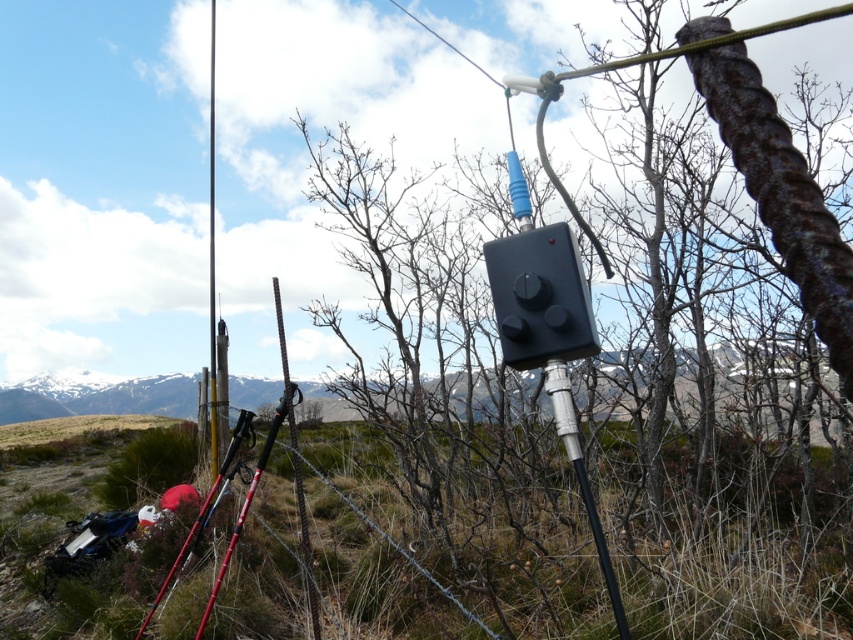
Question: Where is rusty metal pole at center located in relation to red plastic ski pole at lower left in the image?

Choices:
 (A) above
 (B) below

Answer: (A)

Question: Which object is the farthest from the black plastic box at center?

Choices:
 (A) rusty metal pole at center
 (B) red plastic ski pole at lower left

Answer: (A)

Question: Which point is closer to the camera?

Choices:
 (A) (206, 508)
 (B) (241, 515)
 (C) (490, 291)
 (D) (616, 625)

Answer: (D)

Question: Can you confirm if rusty metal pole at center is thinner than red plastic ski pole at lower left?

Choices:
 (A) no
 (B) yes

Answer: (A)

Question: Which of the following is the closest to the observer?

Choices:
 (A) (566, 433)
 (B) (271, 426)

Answer: (A)

Question: Can you confirm if silver metallic ski pole at center is positioned to the right of red plastic ski pole at lower left?

Choices:
 (A) yes
 (B) no

Answer: (A)